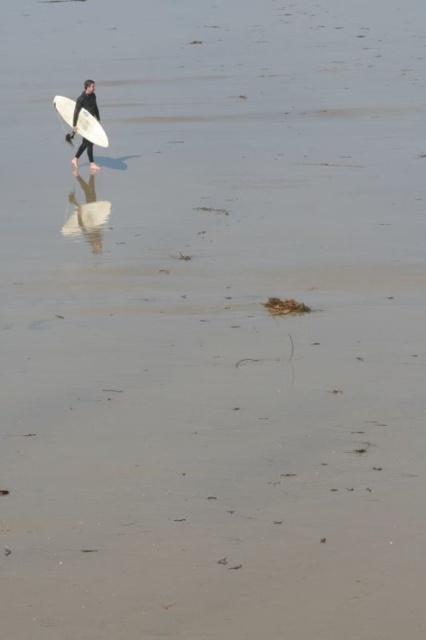
You are a photographer trying to capture the scene of the person walking on the beach. The white matte surfboard at center and the black matte wetsuit at upper left are both in your viewfinder. If you want to ensure both objects are in focus, what is the minimum distance you should set your camera lens to?

The minimum distance you should set your camera lens is 10.93 inches to ensure both the white matte surfboard at center and the black matte wetsuit at upper left are in focus.

You are a lifeguard assessing the scene. You see the white matte surfboard at center and the black matte wetsuit at upper left. Which object is wider in the image?

The white matte surfboard at center is wider than the black matte wetsuit at upper left according to the description.